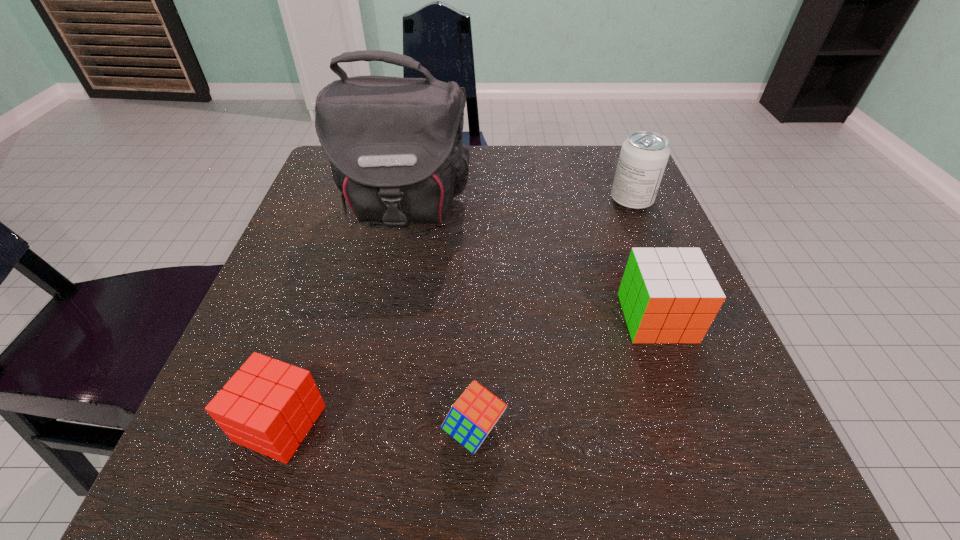
Locate an element on the screen. The image size is (960, 540). vacant region located on the right of the leftmost cube is located at coordinates (359, 423).

Identify the location of free region located on the left of the shortest object. (204, 430).

In order to click on shoulder bag present at the far edge in this screenshot , I will do `click(395, 146)`.

Identify the location of soda can positioned at the far edge. This screenshot has height=540, width=960. (643, 158).

Locate an element on the screen. Image resolution: width=960 pixels, height=540 pixels. shoulder bag that is at the left edge is located at coordinates (395, 146).

Locate an element on the screen. Image resolution: width=960 pixels, height=540 pixels. cube present at the left edge is located at coordinates (269, 406).

Image resolution: width=960 pixels, height=540 pixels. Find the location of `soda can situated at the right edge`. soda can situated at the right edge is located at coordinates (643, 158).

Locate an element on the screen. The height and width of the screenshot is (540, 960). cube at the right edge is located at coordinates (668, 295).

The width and height of the screenshot is (960, 540). Identify the location of object present at the far left corner. (395, 146).

Locate an element on the screen. The image size is (960, 540). object at the near left corner is located at coordinates (269, 406).